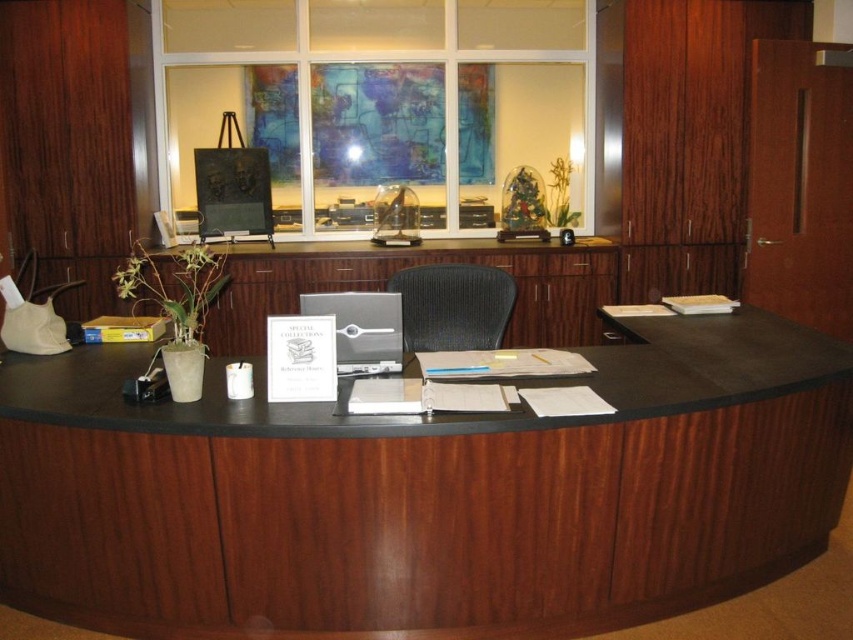
Question: Among these objects, which one is nearest to the camera?

Choices:
 (A) satin silver laptop at center
 (B) matte gray chair at center

Answer: (A)

Question: Is wooden desk at center to the right of satin silver laptop at center from the viewer's perspective?

Choices:
 (A) no
 (B) yes

Answer: (B)

Question: Observing the image, what is the correct spatial positioning of matte gray chair at center in reference to satin silver laptop at center?

Choices:
 (A) above
 (B) below

Answer: (A)

Question: Is dark wood/black laminate desk at center thinner than satin silver laptop at center?

Choices:
 (A) yes
 (B) no

Answer: (B)

Question: Which point is closer to the camera?

Choices:
 (A) (743, 506)
 (B) (415, 349)
 (C) (370, 292)

Answer: (A)

Question: Among these objects, which one is nearest to the camera?

Choices:
 (A) matte gray chair at center
 (B) dark wood/black laminate desk at center
 (C) wooden desk at center

Answer: (B)